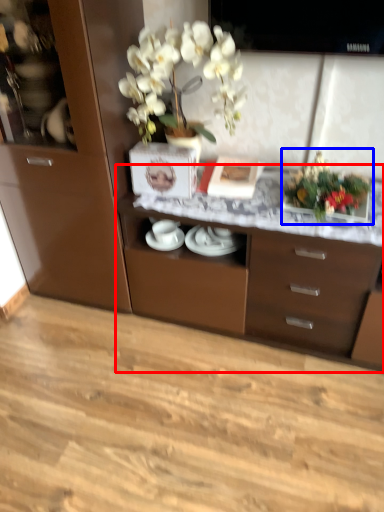
Question: Which object is further to the camera taking this photo, desk (highlighted by a red box) or floral arrangement (highlighted by a blue box)?

Choices:
 (A) desk
 (B) floral arrangement

Answer: (B)